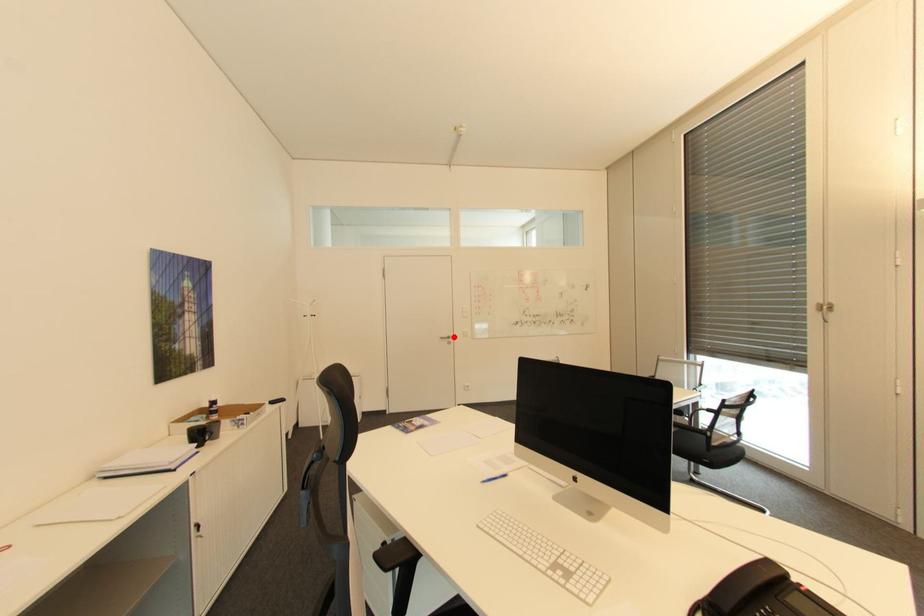
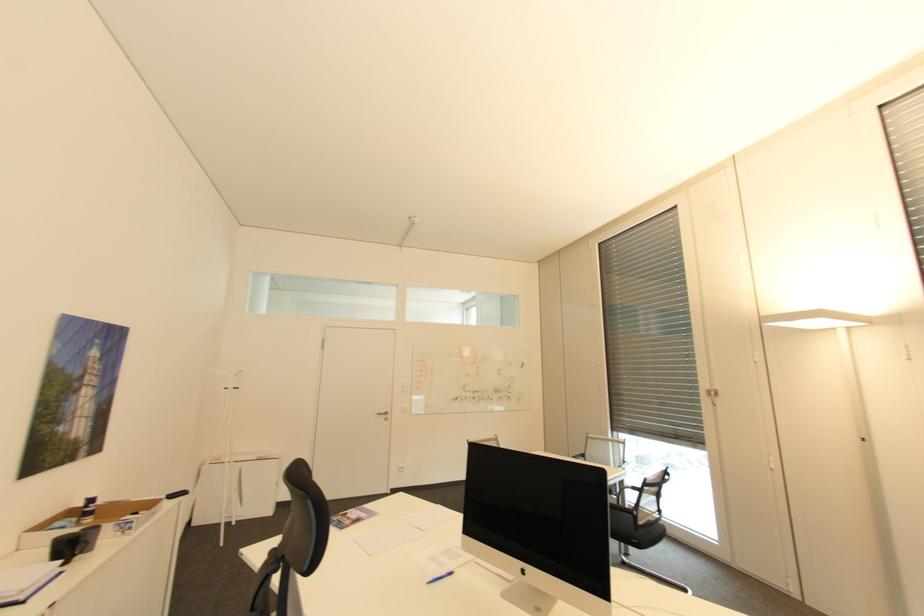
Question: I am providing you with two images of the same scene from different viewpoints. A red point is shown in image1. For the corresponding object point in image2, is it positioned nearer or farther from the camera?

Choices:
 (A) Nearer
 (B) Farther

Answer: (B)